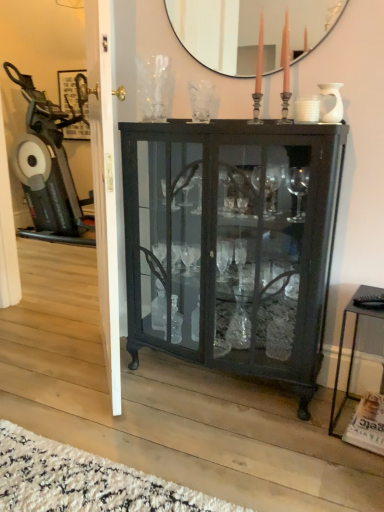
Locate an element on the screen. free space in front of black metal side table at lower right is located at coordinates (352, 468).